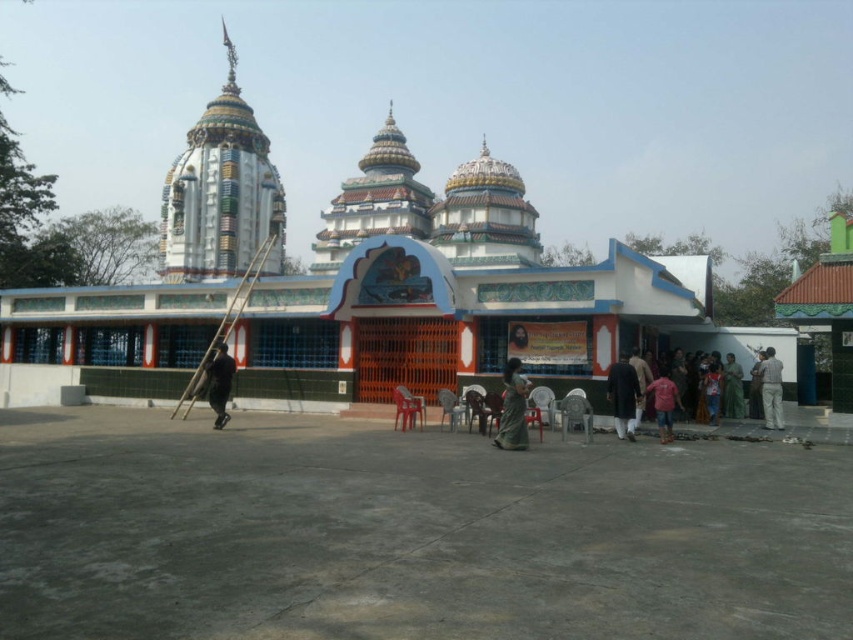
Question: Which of the following is the farthest from the observer?

Choices:
 (A) (711, 403)
 (B) (505, 420)
 (C) (631, 378)

Answer: (A)

Question: Does dark brown fabric at center lie behind green fabric statue at lower right?

Choices:
 (A) no
 (B) yes

Answer: (A)

Question: Which point is closer to the camera?

Choices:
 (A) (207, 356)
 (B) (773, 406)
 (C) (738, 376)

Answer: (B)

Question: Considering the real-world distances, which object is farthest from the green fabric statue at lower right?

Choices:
 (A) dark blue fabric dress at lower right
 (B) pink fabric at lower center

Answer: (B)

Question: From the image, what is the correct spatial relationship of dark blue fabric at center in relation to pink fabric at lower center?

Choices:
 (A) below
 (B) above

Answer: (B)

Question: Does decorative mosaic dome at upper left appear on the right side of dark blue fabric at center?

Choices:
 (A) yes
 (B) no

Answer: (B)